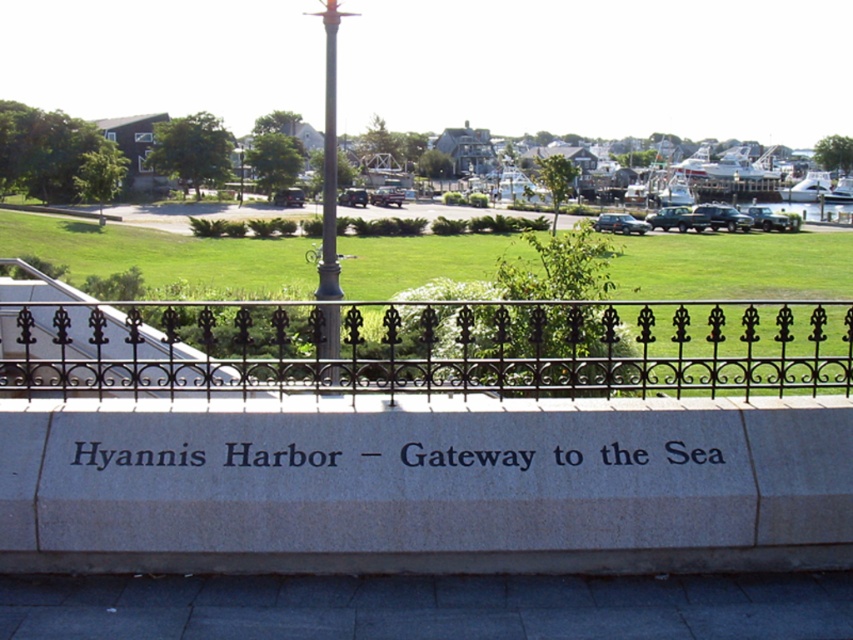
You are standing in Hyannis Harbor and want to take a photo of the black stone sign at center and the polished metal pole at center. Which object should you place on the left side of your camera frame to ensure both are visible?

To ensure both the black stone sign at center and the polished metal pole at center are visible, you should place the polished metal pole at center on the left side of your camera frame since the black stone sign at center is on its right side.